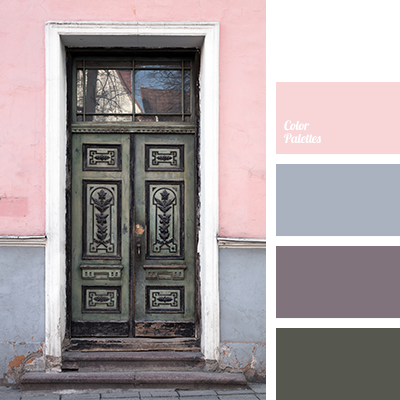
You are a GUI agent. You are given a task and a screenshot of the screen. Output one action in this format:
    pyautogui.click(x=<x>, y=<y>)
    Task: Click on the ornamentation
    This screenshot has width=400, height=400.
    Given the screenshot: What is the action you would take?
    pyautogui.click(x=166, y=194), pyautogui.click(x=165, y=205), pyautogui.click(x=101, y=191), pyautogui.click(x=101, y=201)